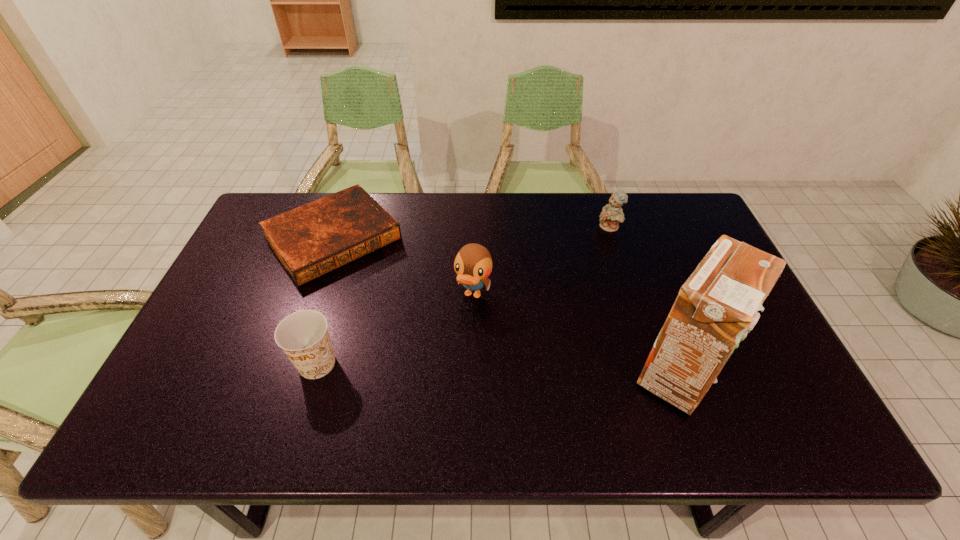
Find the location of `free space located 0.400m on the front-facing side of the teddy bear`. free space located 0.400m on the front-facing side of the teddy bear is located at coordinates (543, 313).

The height and width of the screenshot is (540, 960). Find the location of `free point located 0.340m on the spine side of the Bible`. free point located 0.340m on the spine side of the Bible is located at coordinates (431, 352).

Find the location of `free space located on the spine side of the Bible`. free space located on the spine side of the Bible is located at coordinates (378, 289).

You are a GUI agent. You are given a task and a screenshot of the screen. Output one action in this format:
    pyautogui.click(x=<x>, y=<y>)
    Task: Click on the free space located on the spine side of the Bible
    
    Given the screenshot: What is the action you would take?
    pyautogui.click(x=404, y=320)

The height and width of the screenshot is (540, 960). Find the location of `vacant area situated on the front-facing side of the second tallest object`. vacant area situated on the front-facing side of the second tallest object is located at coordinates [439, 383].

This screenshot has width=960, height=540. What are the coordinates of `vacant space situated on the front-facing side of the second tallest object` in the screenshot? It's located at (452, 349).

Locate an element on the screen. This screenshot has height=540, width=960. vacant area situated on the front-facing side of the second tallest object is located at coordinates (434, 394).

The height and width of the screenshot is (540, 960). Find the location of `teddy bear located in the far edge section of the desktop`. teddy bear located in the far edge section of the desktop is located at coordinates (612, 214).

The height and width of the screenshot is (540, 960). Identify the location of Bible present at the far edge. [x=316, y=238].

Find the location of `Dixie cup at the near edge`. Dixie cup at the near edge is located at coordinates (303, 335).